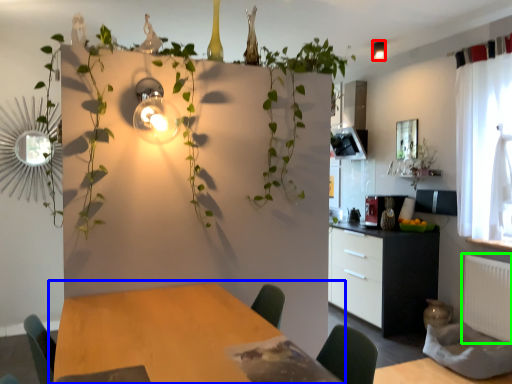
Question: Which object is positioned closest to light fixture (highlighted by a red box)? Select from table (highlighted by a blue box) and radiator (highlighted by a green box).

Choices:
 (A) table
 (B) radiator

Answer: (B)